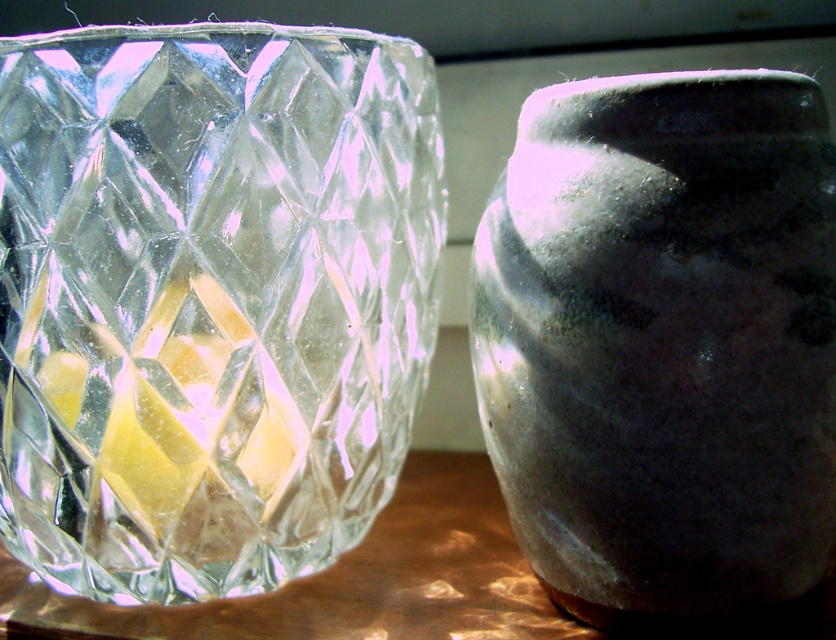
Does transparent crystal glass at left have a larger size compared to matte gray vase at right?

Indeed, transparent crystal glass at left has a larger size compared to matte gray vase at right.

Does point (79, 260) come closer to viewer compared to point (548, 458)?

That is False.

This screenshot has height=640, width=836. I want to click on transparent crystal glass at left, so click(x=209, y=298).